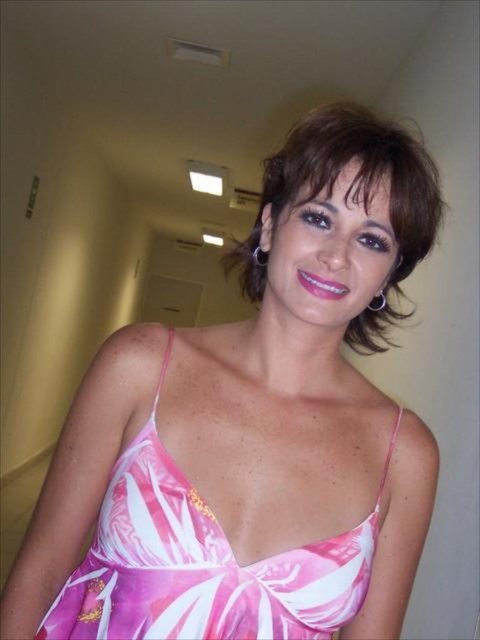
Which is behind, point (333, 556) or point (344, 182)?

The point (333, 556) is more distant.

Can you confirm if pink floral fabric dress at center is smaller than brown hair at upper center?

No.

Is point (165, 620) behind point (387, 188)?

Yes, point (165, 620) is behind point (387, 188).

Where is `pink floral fabric dress at center`? pink floral fabric dress at center is located at coordinates (202, 563).

Can you confirm if brown smooth hair at center is wider than brown hair at upper center?

Yes.

Does point (356, 326) come farther from viewer compared to point (345, 188)?

Yes, it is.

Is point (405, 195) positioned behind point (326, 189)?

Yes.

Where is `brown smooth hair at center`? This screenshot has width=480, height=640. brown smooth hair at center is located at coordinates (350, 198).

Does pink floral fabric dress at center have a greater width compared to brown smooth hair at center?

No.

Does pink floral fabric dress at center appear over brown smooth hair at center?

No.

Who is more forward, (x=204, y=605) or (x=301, y=170)?

Point (x=301, y=170) is in front.

Identify the location of pink floral fabric dress at center. (202, 563).